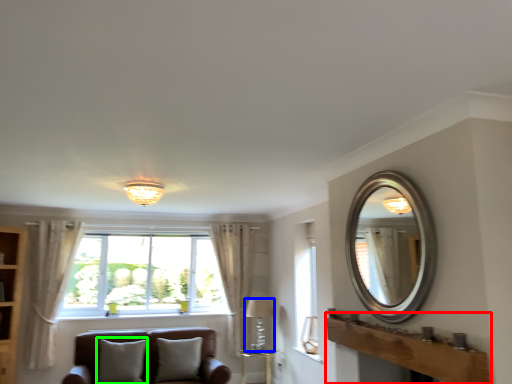
Question: Based on their relative distances, which object is farther from mantle (highlighted by a red box)? Choose from lamp (highlighted by a blue box) and pillow (highlighted by a green box).

Choices:
 (A) lamp
 (B) pillow

Answer: (A)